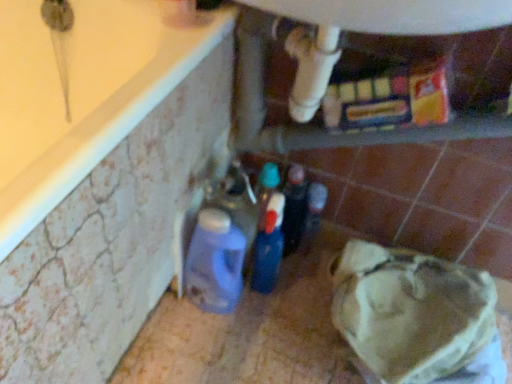
Where is `free space in front of matte plastic detergent at lower left, positioned as the 1th bottle in left-to-right order`? This screenshot has width=512, height=384. free space in front of matte plastic detergent at lower left, positioned as the 1th bottle in left-to-right order is located at coordinates (198, 349).